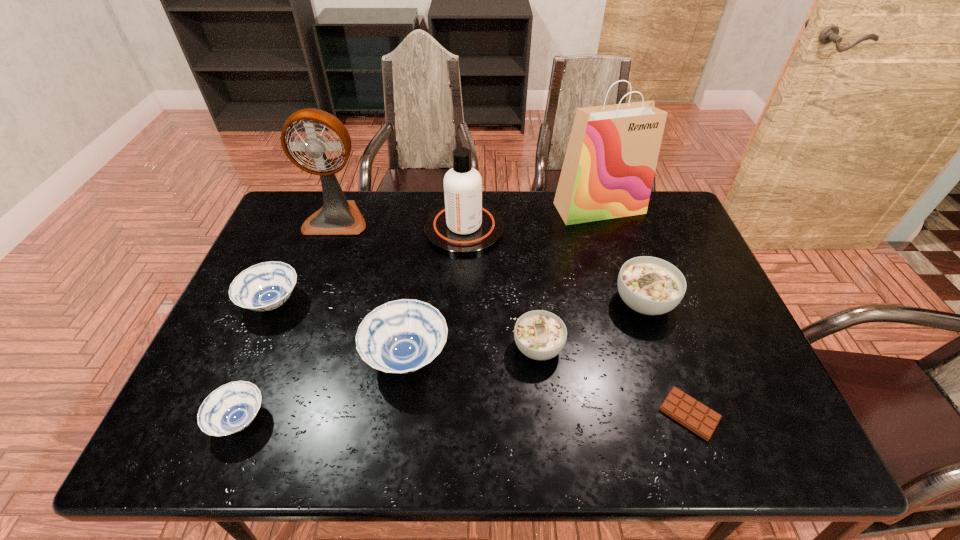
You are a GUI agent. You are given a task and a screenshot of the screen. Output one action in this format:
    pyautogui.click(x=<x>, y=<y>)
    Task: Click on the free space at the far left corner
    
    Given the screenshot: What is the action you would take?
    pyautogui.click(x=297, y=193)

Locate an element on the screen. This screenshot has height=540, width=960. free space at the near left corner is located at coordinates (196, 431).

Where is `free point between the second biggest blue soup bowl and the third soup bowl from left to right`? The width and height of the screenshot is (960, 540). free point between the second biggest blue soup bowl and the third soup bowl from left to right is located at coordinates (340, 330).

The height and width of the screenshot is (540, 960). I want to click on free space between the shopping bag and the rightmost blue soup bowl, so click(503, 282).

What are the coordinates of `vacant region between the cleansing agent and the third soup bowl from left to right` in the screenshot? It's located at (436, 293).

Image resolution: width=960 pixels, height=540 pixels. In order to click on vacant space that is in between the shortest soup bowl and the candy bar in this screenshot , I will do click(x=465, y=417).

The height and width of the screenshot is (540, 960). Identify the location of blank region between the second smallest blue soup bowl and the shortest soup bowl. (256, 361).

Locate an element on the screen. vacant region between the fan and the nearer white soup bowl is located at coordinates (438, 283).

The height and width of the screenshot is (540, 960). I want to click on free space between the third soup bowl from left to right and the fan, so click(x=372, y=288).

Identify the location of vacant space in between the nearer white soup bowl and the biggest blue soup bowl. The height and width of the screenshot is (540, 960). (472, 352).